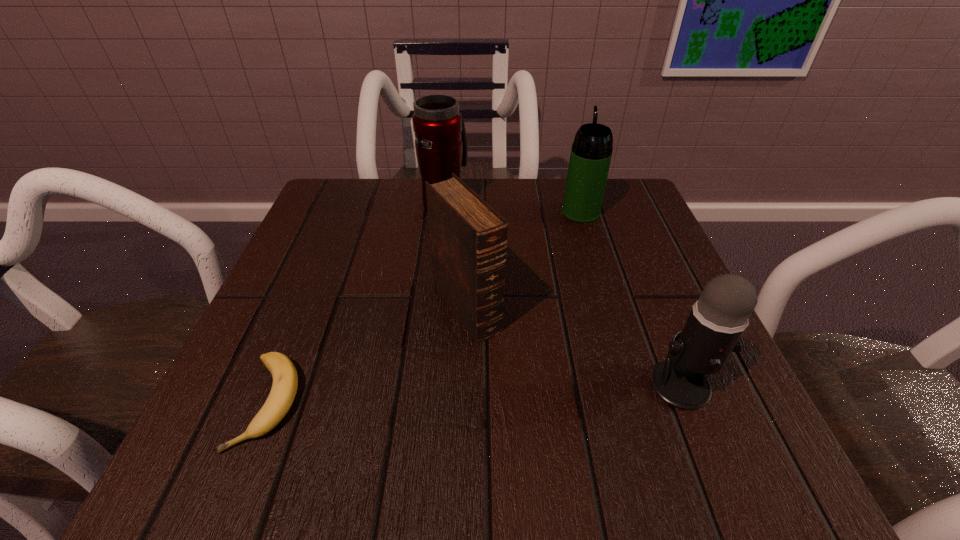
Where is `the left thermos bottle`? the left thermos bottle is located at coordinates (441, 147).

You are a GUI agent. You are given a task and a screenshot of the screen. Output one action in this format:
    pyautogui.click(x=<x>, y=<y>)
    Task: Click on the right thermos bottle
    
    Given the screenshot: What is the action you would take?
    pyautogui.click(x=591, y=152)

This screenshot has height=540, width=960. I want to click on Bible, so click(468, 238).

Locate an element on the screen. The height and width of the screenshot is (540, 960). microphone is located at coordinates click(717, 320).

I want to click on the shortest object, so click(285, 379).

In order to click on the leftmost object in this screenshot , I will do `click(285, 379)`.

At what (x,y) coordinates should I click in order to perform the action: click on free space located 0.060m from the spout of the right thermos bottle. Please return your answer as a coordinate pair (x, y). This screenshot has height=540, width=960. Looking at the image, I should click on (574, 188).

The height and width of the screenshot is (540, 960). I want to click on free spot located on the right of the third farthest object, so click(x=589, y=309).

This screenshot has height=540, width=960. I want to click on free space located 0.170m on the back of the microphone, so click(x=641, y=285).

At what (x,y) coordinates should I click in order to perform the action: click on object that is at the near edge. Please return your answer as a coordinate pair (x, y). Image resolution: width=960 pixels, height=540 pixels. Looking at the image, I should click on (285, 379).